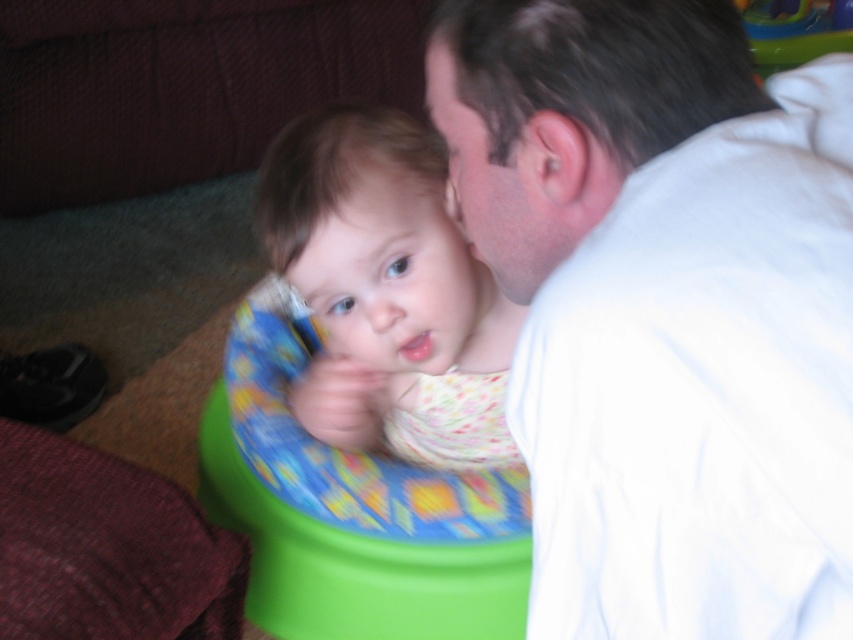
Question: Can you confirm if white smooth shirt at upper right is wider than floral fabric baby at center?

Choices:
 (A) no
 (B) yes

Answer: (A)

Question: Which object appears closest to the camera in this image?

Choices:
 (A) white smooth shirt at upper right
 (B) floral fabric baby at center

Answer: (A)

Question: Observing the image, what is the correct spatial positioning of white smooth shirt at upper right in reference to floral fabric baby at center?

Choices:
 (A) above
 (B) below

Answer: (A)

Question: Can you confirm if white smooth shirt at upper right is positioned to the right of floral fabric baby at center?

Choices:
 (A) no
 (B) yes

Answer: (B)